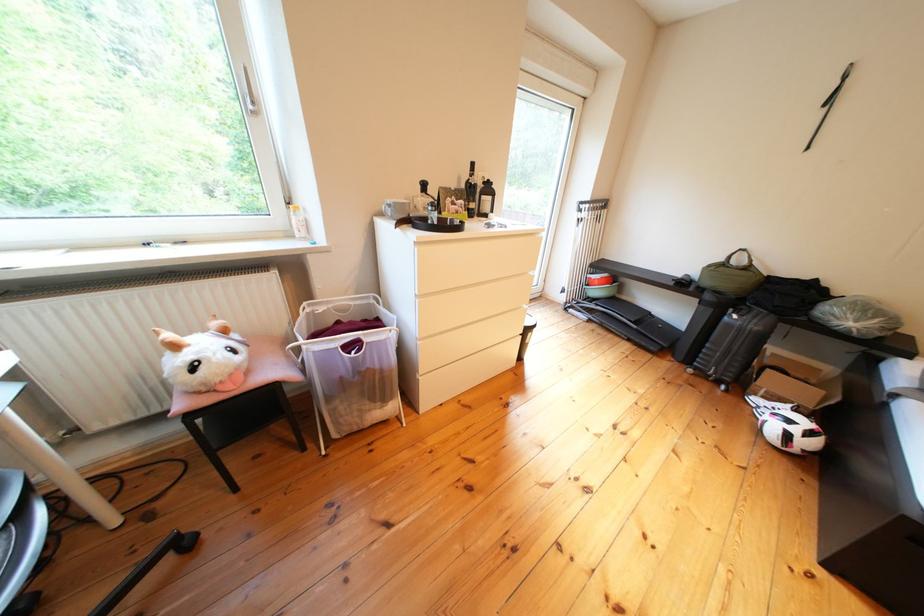
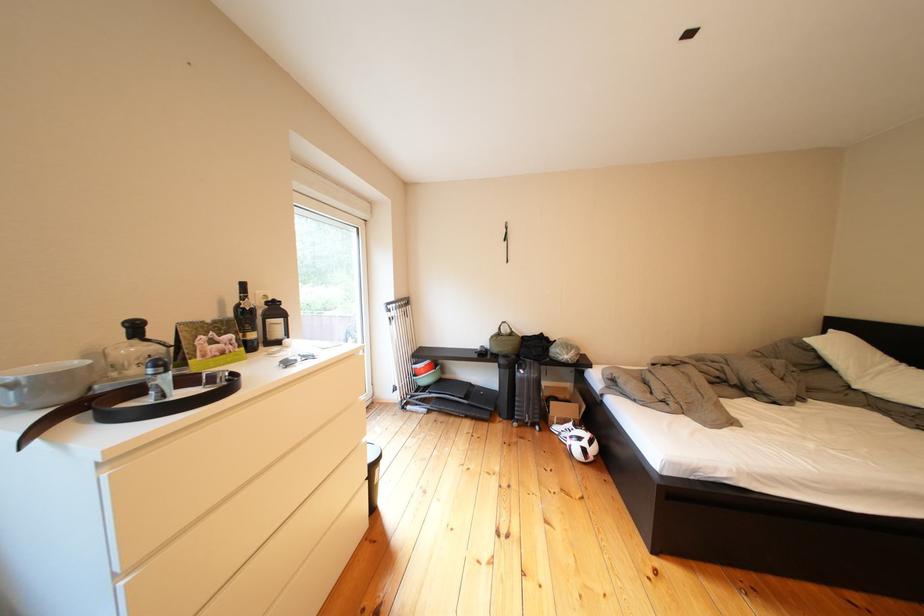
In the second image, find the point that corresponds to point (430, 254) in the first image.

(118, 482)